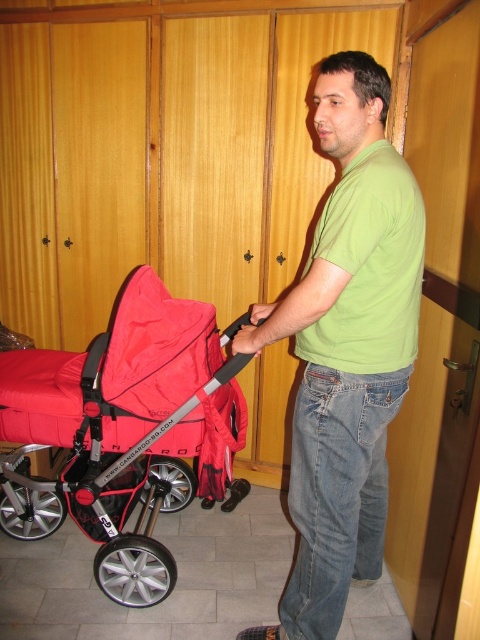
Question: Is green matte shirt at center wider than red fabric stroller at left?

Choices:
 (A) yes
 (B) no

Answer: (B)

Question: Does green matte shirt at center have a greater width compared to red fabric stroller at left?

Choices:
 (A) yes
 (B) no

Answer: (B)

Question: Observing the image, what is the correct spatial positioning of green matte shirt at center in reference to red fabric stroller at left?

Choices:
 (A) below
 (B) above

Answer: (B)

Question: Which object appears closest to the camera in this image?

Choices:
 (A) red fabric stroller at left
 (B) green matte shirt at center

Answer: (B)